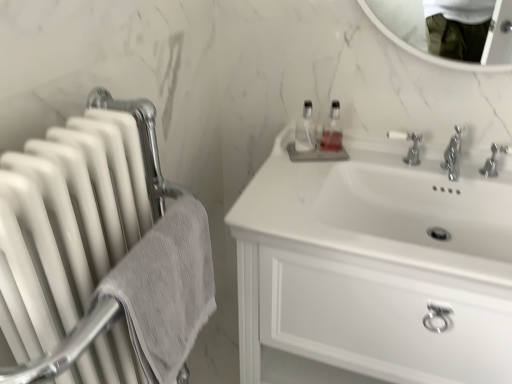
Question: From the image's perspective, is white glossy cabinet at upper right above or below silver metallic tap at upper center, marked as the second tap in a right-to-left arrangement?

Choices:
 (A) above
 (B) below

Answer: (B)

Question: Which is correct: white glossy cabinet at upper right is inside silver metallic tap at upper center, which ranks as the 1th tap in left-to-right order, or outside of it?

Choices:
 (A) outside
 (B) inside

Answer: (A)

Question: Which object is positioned closest to the translucent plastic soap dispenser at upper center?

Choices:
 (A) white glossy radiator at left
 (B) silver metallic tap at upper center, marked as the second tap in a right-to-left arrangement
 (C) gray textured towel at left
 (D) polished chrome faucet at center right, the first tap viewed from the right
 (E) clear glass bottle at center

Answer: (E)

Question: Which of these objects is positioned farthest from the white glossy cabinet at upper right?

Choices:
 (A) polished chrome faucet at center right, the first tap viewed from the right
 (B) clear glass bottle at center
 (C) silver metallic tap at upper center, marked as the second tap in a right-to-left arrangement
 (D) translucent plastic soap dispenser at upper center
 (E) white glossy radiator at left

Answer: (A)